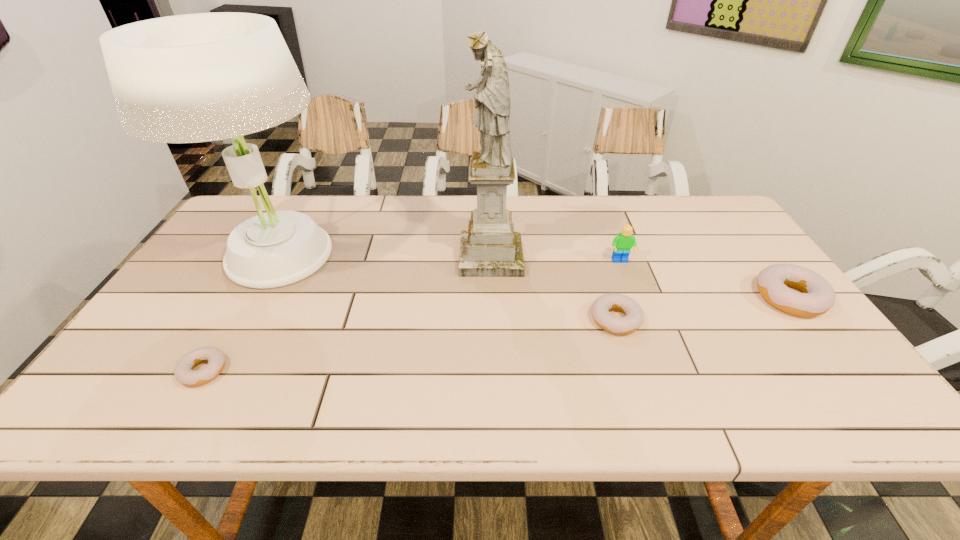
The height and width of the screenshot is (540, 960). In order to click on the shortest doughnut in this screenshot , I will do `click(184, 373)`.

This screenshot has width=960, height=540. I want to click on the nearest object, so click(x=184, y=373).

At what (x,y) coordinates should I click in order to perform the action: click on the second shortest doughnut. Please return your answer as a coordinate pair (x, y). The width and height of the screenshot is (960, 540). Looking at the image, I should click on (634, 318).

Where is `the fifth tallest object`? the fifth tallest object is located at coordinates (634, 318).

Locate an element on the screen. The image size is (960, 540). the rightmost object is located at coordinates (x=818, y=296).

This screenshot has height=540, width=960. I want to click on the third shortest object, so click(x=818, y=296).

Locate an element on the screen. the third object from left to right is located at coordinates (489, 248).

This screenshot has height=540, width=960. I want to click on lamp, so click(x=191, y=78).

At what (x,y) coordinates should I click in order to perform the action: click on the third tallest object. Please return your answer as a coordinate pair (x, y). Looking at the image, I should click on (622, 244).

The height and width of the screenshot is (540, 960). What are the coordinates of `vacant space situated on the back of the nearest doughnut` in the screenshot? It's located at (269, 259).